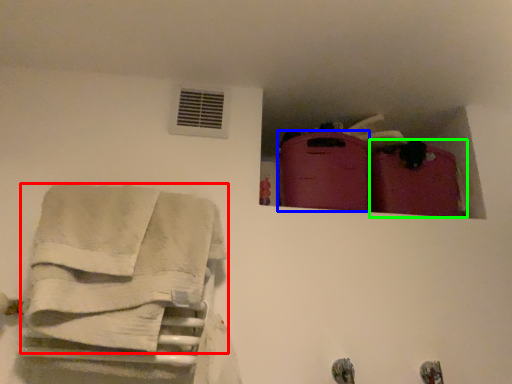
Question: Which object is positioned farthest from towel (highlighted by a red box)? Select from luggage (highlighted by a blue box) and luggage (highlighted by a green box).

Choices:
 (A) luggage
 (B) luggage

Answer: (B)